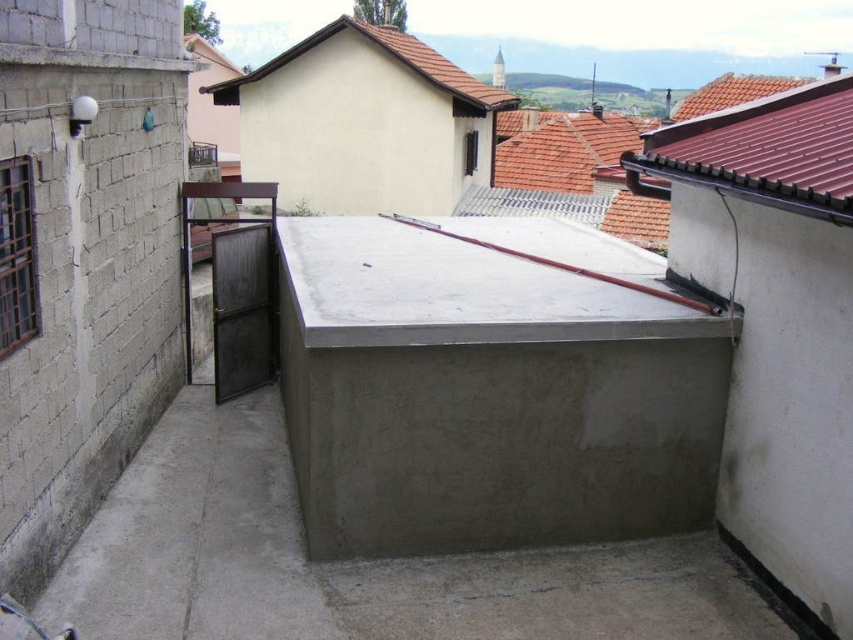
Which is in front, point (292, 554) or point (230, 88)?

Positioned in front is point (292, 554).

You are a GUI agent. You are given a task and a screenshot of the screen. Output one action in this format:
    pyautogui.click(x=<x>, y=<y>)
    Task: Click on the gray concrete at center
    The width and height of the screenshot is (853, 640).
    Given the screenshot: What is the action you would take?
    pyautogui.click(x=352, y=561)

Is gray concrete at center to the left of brown tile roof at upper right from the viewer's perspective?

Yes, gray concrete at center is to the left of brown tile roof at upper right.

Does gray concrete at center have a larger size compared to brown tile roof at upper right?

Indeed, gray concrete at center has a larger size compared to brown tile roof at upper right.

In order to click on gray concrete at center in this screenshot , I will do `click(352, 561)`.

What do you see at coordinates (762, 150) in the screenshot? I see `brown tile roof at upper right` at bounding box center [762, 150].

Which is in front, point (747, 147) or point (436, 52)?

Point (747, 147) is more forward.

Locate an element on the screen. The height and width of the screenshot is (640, 853). brown tile roof at upper right is located at coordinates (762, 150).